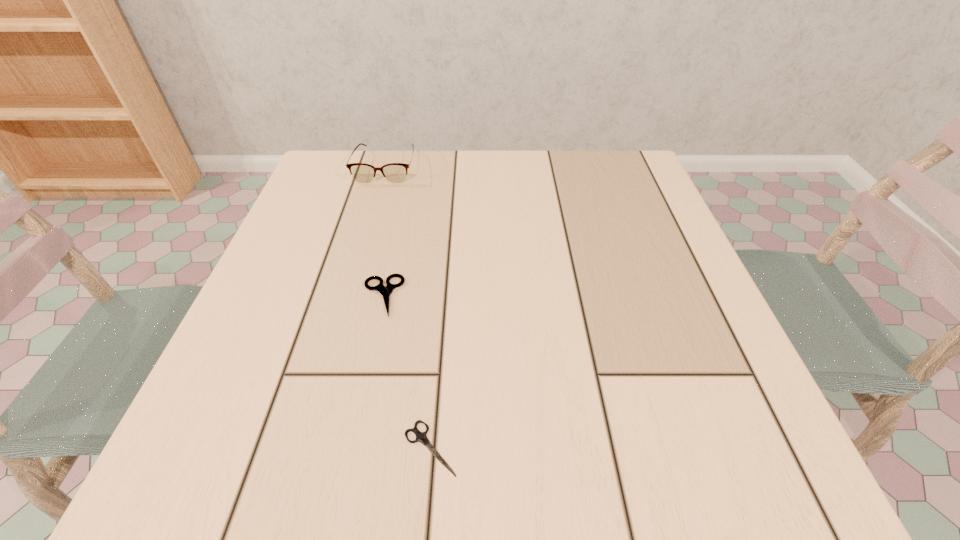
Where is `object at the near edge`? object at the near edge is located at coordinates coord(421,437).

Identify the location of object that is at the left edge. (394, 172).

You are a GUI agent. You are given a task and a screenshot of the screen. Output one action in this format:
    pyautogui.click(x=<x>, y=<y>)
    Task: Click on the object that is positioned at the far left corner
    The width and height of the screenshot is (960, 540).
    Given the screenshot: What is the action you would take?
    [394, 172]

You are a GUI agent. You are given a task and a screenshot of the screen. Output one action in this format:
    pyautogui.click(x=<x>, y=<y>)
    Task: Click on the vacant space at the far edge of the desktop
    The width and height of the screenshot is (960, 540).
    Given the screenshot: What is the action you would take?
    pyautogui.click(x=563, y=183)

Where is `vacant space at the near edge of the desktop`? The height and width of the screenshot is (540, 960). vacant space at the near edge of the desktop is located at coordinates (545, 431).

I want to click on vacant area at the left edge of the desktop, so [308, 233].

The width and height of the screenshot is (960, 540). Find the location of `free space at the right edge of the desktop`. free space at the right edge of the desktop is located at coordinates (632, 345).

Locate an element on the screen. The image size is (960, 540). blank space at the near left corner is located at coordinates (198, 431).

Find the location of a particular element. This screenshot has height=540, width=960. blank space at the far right corner is located at coordinates (633, 199).

I want to click on vacant space at the near right corner of the desktop, so click(x=752, y=436).